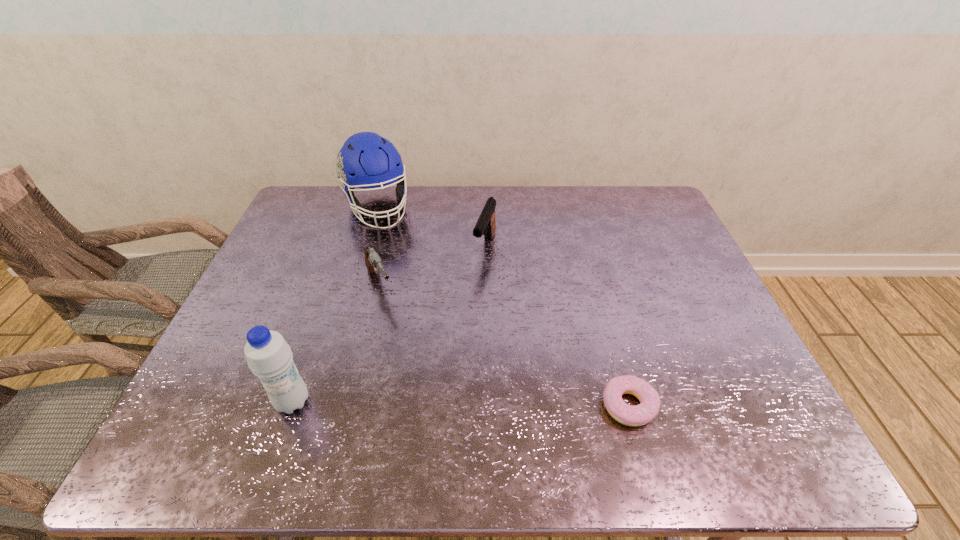
This screenshot has height=540, width=960. I want to click on free space on the desktop that is between the water bottle and the doughnut and is positioned at the barrel of the shorter pistol, so click(447, 403).

Identify the location of free spot on the desktop that is between the water bottle and the doughnut and is positioned at the barrel of the taller pistol. (420, 403).

Find the location of a particular element. The height and width of the screenshot is (540, 960). vacant spot on the desktop that is between the water bottle and the rightmost object and is positioned on the face guard of the football helmet is located at coordinates (475, 404).